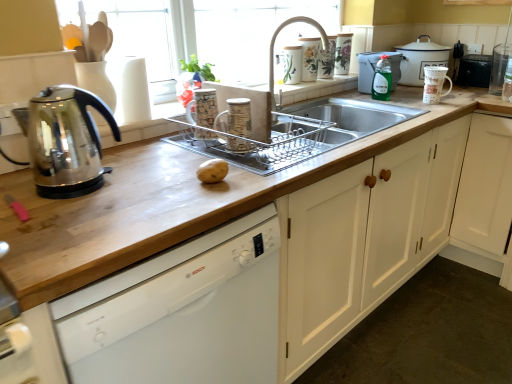
In order to click on free point to the right of transparent glass kettle at left, positioned as the 3th kitchen appliance in back-to-front order in this screenshot , I will do `click(155, 178)`.